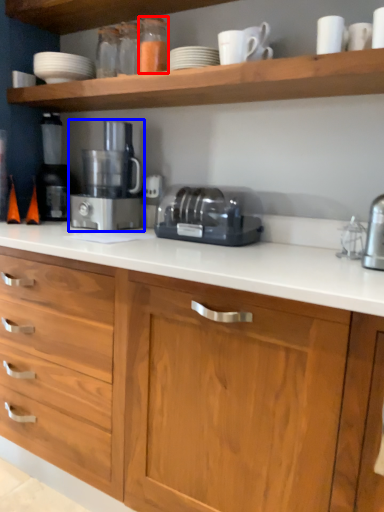
Question: Which object is closer to the camera taking this photo, bottle (highlighted by a red box) or home appliance (highlighted by a blue box)?

Choices:
 (A) bottle
 (B) home appliance

Answer: (A)